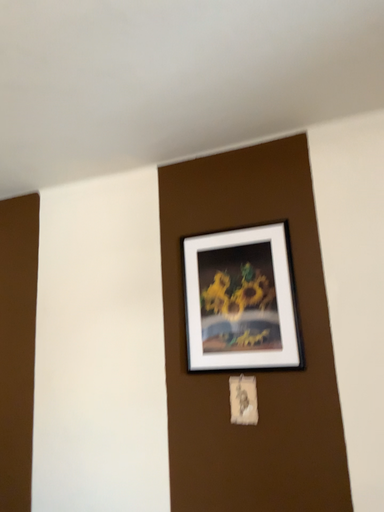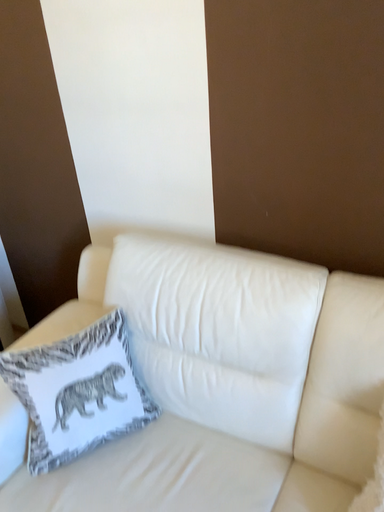
Question: How did the camera likely rotate when shooting the video?

Choices:
 (A) rotated right
 (B) rotated left

Answer: (B)